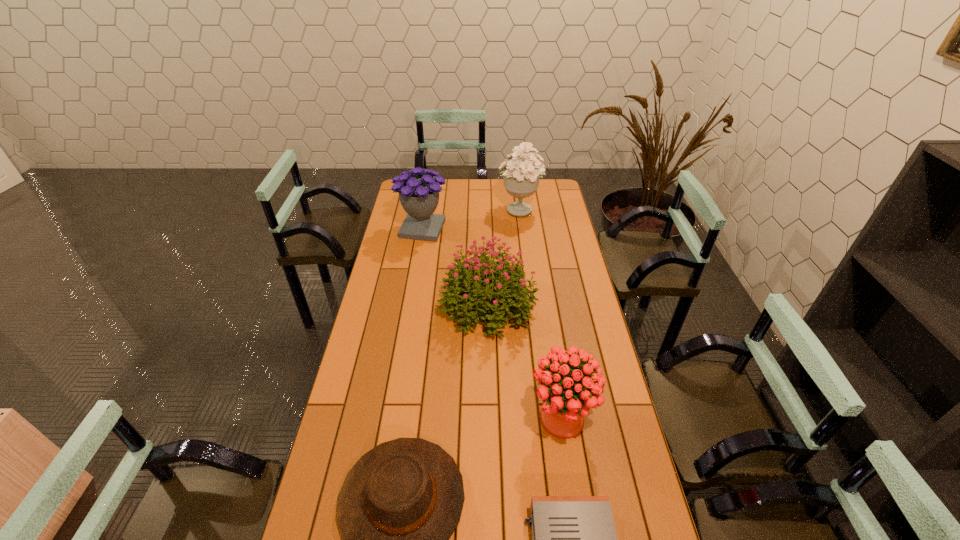
Where is `vacant region between the second nearest bouquet and the nearest bouquet`? vacant region between the second nearest bouquet and the nearest bouquet is located at coordinates (524, 362).

Locate an element on the screen. object that stands as the closest to the fifth tallest object is located at coordinates (574, 539).

I want to click on the fifth closest object to the third farthest object, so click(x=574, y=539).

Point out which bouquet is positioned as the nearest to the nearest bouquet. Please provide its 2D coordinates. Your answer should be formatted as a tuple, i.e. [(x, y)], where the tuple contains the x and y coordinates of a point satisfying the conditions above.

[(465, 287)]

The image size is (960, 540). I want to click on the third closest bouquet relative to the nearest bouquet, so click(x=521, y=179).